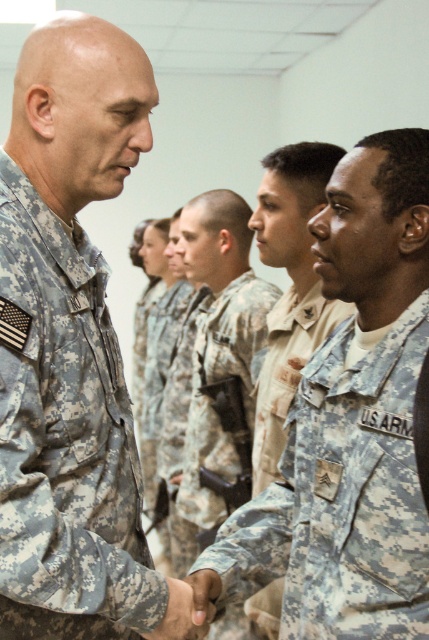
You are a photographer trying to capture a group photo of the military personnel in the scene. You need to position yourself between the two points marked as point [326,548] and point [129,568]. Which point should you stand closer to in order to ensure all subjects are in focus?

You should stand closer to point [129,568] because point [326,548] is further away from the viewer, so positioning yourself closer to the nearer point will help keep all subjects in focus.

You are a photographer at this event and need to ensure both individuals in the center and left are clearly visible in the photo. Given that the camouflage uniform at center is larger than the camouflage fabric uniform at left, which one might appear closer to the camera in the photo?

The camouflage uniform at center is bigger than the camouflage fabric uniform at left, so it might appear closer to the camera in the photo since larger objects often appear nearer.